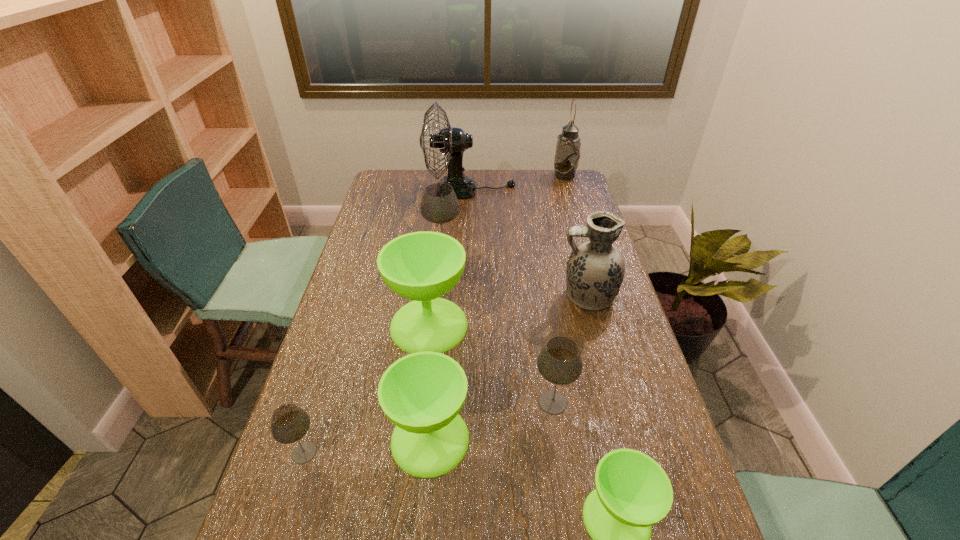
Locate an element on the screen. vacant region located 0.100m on the right of the second nearest green wineglass is located at coordinates (513, 439).

Identify the location of vacant space located 0.300m on the back of the leftmost gray wineglass. The image size is (960, 540). (340, 339).

Locate an element on the screen. fan present at the far edge is located at coordinates (452, 141).

What are the coordinates of `oil lamp that is at the far edge` in the screenshot? It's located at (567, 155).

Where is `object present at the left edge`? The height and width of the screenshot is (540, 960). object present at the left edge is located at coordinates (289, 423).

The image size is (960, 540). I want to click on oil lamp at the right edge, so click(567, 155).

Where is `vase present at the right edge`? This screenshot has height=540, width=960. vase present at the right edge is located at coordinates [595, 270].

Locate an element on the screen. object that is positioned at the far right corner is located at coordinates (567, 155).

I want to click on vacant space at the left edge of the desktop, so click(318, 538).

At what (x,y) coordinates should I click in order to perform the action: click on free region at the right edge. Please return your answer as a coordinate pair (x, y). Image resolution: width=960 pixels, height=540 pixels. Looking at the image, I should click on (615, 329).